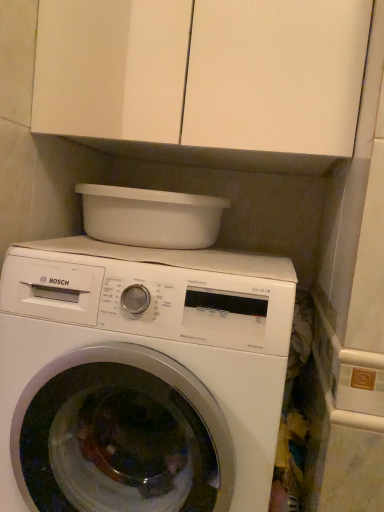
Where is `free space above white glossy washing machine at center (from a real-world perspective)`? free space above white glossy washing machine at center (from a real-world perspective) is located at coordinates (165, 250).